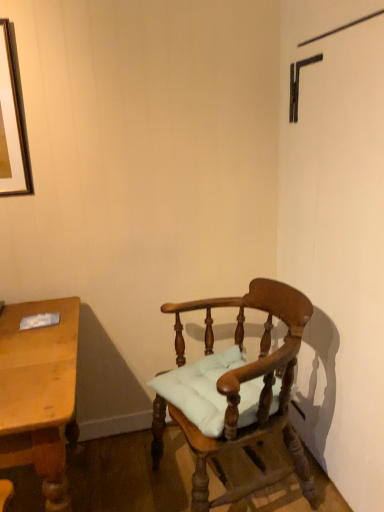
Describe the element at coordinates (39, 393) in the screenshot. I see `light brown wooden desk at left` at that location.

At what (x,y) coordinates should I click in order to perform the action: click on light brown wooden desk at left. Please return your answer as a coordinate pair (x, y). The height and width of the screenshot is (512, 384). Looking at the image, I should click on (39, 393).

The image size is (384, 512). I want to click on wooden chair with cushion at center, so click(234, 389).

Describe the element at coordinates (234, 389) in the screenshot. This screenshot has width=384, height=512. I see `wooden chair with cushion at center` at that location.

Measure the distance between wooden chair with cushion at center and camera.

1.18 meters.

Locate an element on the screen. light brown wooden desk at left is located at coordinates (39, 393).

Does wooden chair with cushion at center appear on the right side of light brown wooden desk at left?

Yes, wooden chair with cushion at center is to the right of light brown wooden desk at left.

Is the depth of wooden chair with cushion at center less than that of light brown wooden desk at left?

No, the depth of wooden chair with cushion at center is greater than that of light brown wooden desk at left.

Is point (195, 365) closer or farther from the camera than point (44, 432)?

Point (195, 365) appears to be farther away from the viewer than point (44, 432).

From the image's perspective, which object appears higher, wooden chair with cushion at center or light brown wooden desk at left?

wooden chair with cushion at center, from the image's perspective.

From a real-world perspective, between wooden chair with cushion at center and light brown wooden desk at left, who is vertically higher?

In real-world perspective, wooden chair with cushion at center is above.

Is wooden chair with cushion at center thinner than light brown wooden desk at left?

Yes.

Between wooden chair with cushion at center and light brown wooden desk at left, which one has less height?

Standing shorter between the two is light brown wooden desk at left.

In terms of size, does wooden chair with cushion at center appear bigger or smaller than light brown wooden desk at left?

wooden chair with cushion at center is bigger than light brown wooden desk at left.

Is light brown wooden desk at left located within wooden chair with cushion at center?

No.

Does wooden chair with cushion at center touch light brown wooden desk at left?

wooden chair with cushion at center is not next to light brown wooden desk at left, and they're not touching.

Could you tell me if wooden chair with cushion at center is facing light brown wooden desk at left?

Yes, wooden chair with cushion at center faces towards light brown wooden desk at left.

Find the location of a particular element. The height and width of the screenshot is (512, 384). desk on the left of wooden chair with cushion at center is located at coordinates (39, 393).

Which is more to the right, light brown wooden desk at left or wooden chair with cushion at center?

From the viewer's perspective, wooden chair with cushion at center appears more on the right side.

Does light brown wooden desk at left lie in front of wooden chair with cushion at center?

Yes, light brown wooden desk at left is closer to the viewer.

Is point (3, 440) closer or farther from the camera than point (207, 309)?

Point (3, 440) is positioned closer to the camera compared to point (207, 309).

Based on the photo, from the image's perspective, is light brown wooden desk at left located beneath wooden chair with cushion at center?

Correct, light brown wooden desk at left appears lower than wooden chair with cushion at center in the image.

From a real-world perspective, which is physically above, light brown wooden desk at left or wooden chair with cushion at center?

wooden chair with cushion at center is physically above.

In the scene shown: Does light brown wooden desk at left have a greater width compared to wooden chair with cushion at center?

Yes, light brown wooden desk at left is wider than wooden chair with cushion at center.

Can you confirm if light brown wooden desk at left is shorter than wooden chair with cushion at center?

Indeed, light brown wooden desk at left has a lesser height compared to wooden chair with cushion at center.

Between light brown wooden desk at left and wooden chair with cushion at center, which one has smaller size?

light brown wooden desk at left.

Is light brown wooden desk at left inside the boundaries of wooden chair with cushion at center, or outside?

The correct answer is: outside.

Is light brown wooden desk at left far from wooden chair with cushion at center?

No.

Is light brown wooden desk at left oriented away from wooden chair with cushion at center?

light brown wooden desk at left is not turned away from wooden chair with cushion at center.

Where is `desk in front of the wooden chair with cushion at center`? desk in front of the wooden chair with cushion at center is located at coordinates (39, 393).

Locate an element on the screen. This screenshot has height=512, width=384. chair behind the light brown wooden desk at left is located at coordinates (234, 389).

Identify the location of desk below the wooden chair with cushion at center (from a real-world perspective). This screenshot has height=512, width=384. click(39, 393).